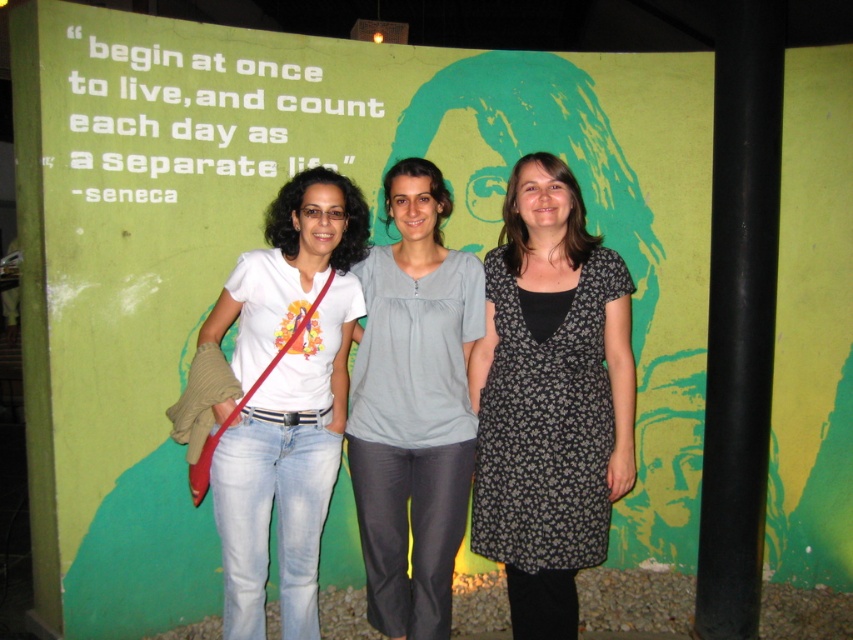
Question: Does black floral dress at center have a lesser width compared to light gray cotton blouse at center?

Choices:
 (A) yes
 (B) no

Answer: (B)

Question: Which object is the farthest from the white cotton t-shirt at center?

Choices:
 (A) light gray cotton blouse at center
 (B) black floral dress at center

Answer: (B)

Question: Considering the real-world distances, which object is farthest from the white cotton t-shirt at center?

Choices:
 (A) black floral dress at center
 (B) light gray cotton blouse at center

Answer: (A)

Question: Which of the following is the closest to the observer?

Choices:
 (A) (566, 257)
 (B) (386, 365)

Answer: (A)

Question: Does black floral dress at center come behind white cotton t-shirt at center?

Choices:
 (A) no
 (B) yes

Answer: (A)

Question: Is light gray cotton blouse at center wider than white cotton t-shirt at center?

Choices:
 (A) yes
 (B) no

Answer: (B)